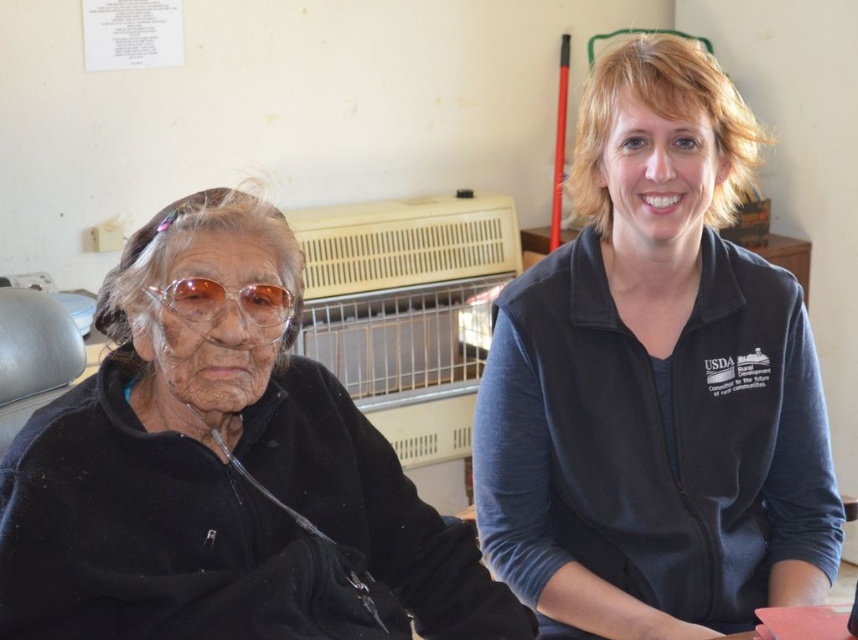
Question: Estimate the real-world distances between objects in this image. Which object is closer to the translucent plastic goggles at upper left?

Choices:
 (A) blue fleece jacket at right
 (B) black fleece at left

Answer: (B)

Question: Is blue fleece jacket at right smaller than translucent plastic goggles at upper left?

Choices:
 (A) no
 (B) yes

Answer: (A)

Question: Can you confirm if blue fleece jacket at right is positioned above black fleece at left?

Choices:
 (A) no
 (B) yes

Answer: (B)

Question: Which of the following is the closest to the observer?

Choices:
 (A) (164, 292)
 (B) (565, 593)

Answer: (A)

Question: Considering the real-world distances, which object is closest to the black fleece at left?

Choices:
 (A) translucent plastic goggles at upper left
 (B) blue fleece jacket at right

Answer: (A)

Question: Is blue fleece jacket at right further to the viewer compared to translucent plastic goggles at upper left?

Choices:
 (A) yes
 (B) no

Answer: (A)